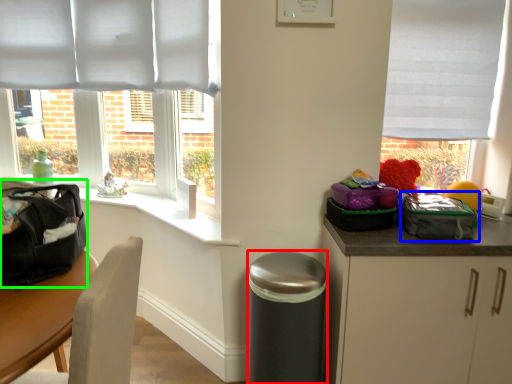
Question: Based on their relative distances, which object is farther from garbage (highlighted by a red box)? Choose from kit (highlighted by a blue box) and pack (highlighted by a green box).

Choices:
 (A) kit
 (B) pack

Answer: (B)